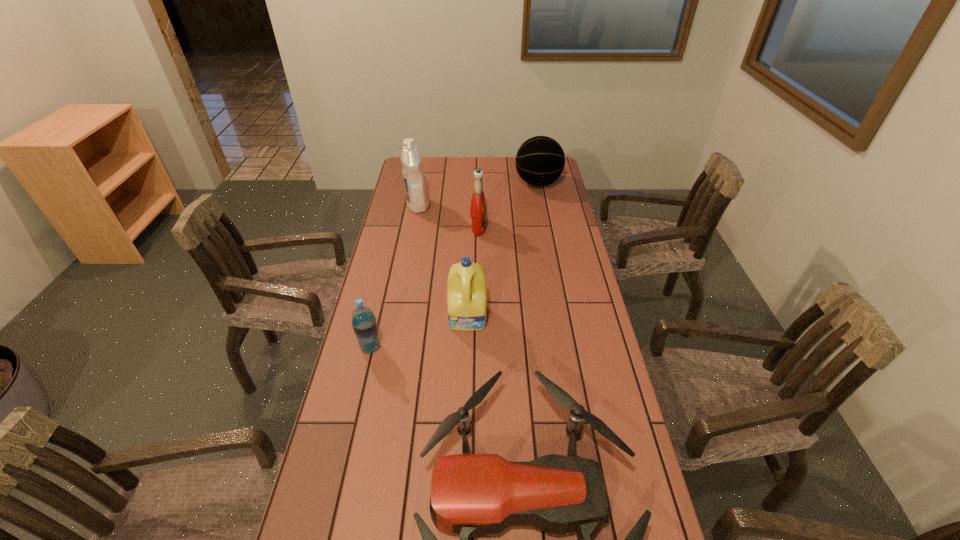
Locate which object ranks in proximity to the drone. Please provide its 2D coordinates. Your answer should be formatted as a tuple, i.e. [(x, y)], where the tuple contains the x and y coordinates of a point satisfying the conditions above.

[(364, 323)]

Identify which object is the third closest to the fifth farthest object. Please provide its 2D coordinates. Your answer should be formatted as a tuple, i.e. [(x, y)], where the tuple contains the x and y coordinates of a point satisfying the conditions above.

[(478, 212)]

Identify the location of the second closest detergent to the fifth nearest object. (467, 304).

Where is `detergent that is the second closest to the third nearest object`? The image size is (960, 540). detergent that is the second closest to the third nearest object is located at coordinates (413, 172).

What are the coordinates of `vacant space that satisfies the following two spatial constraints: 1. on the back side of the second farthest object; 2. on the right side of the fifth farthest object` in the screenshot? It's located at (404, 205).

Where is `free space in the image that satisfies the following two spatial constraints: 1. on the front side of the basketball; 2. on the front surface of the second nearest detergent`? The width and height of the screenshot is (960, 540). free space in the image that satisfies the following two spatial constraints: 1. on the front side of the basketball; 2. on the front surface of the second nearest detergent is located at coordinates (546, 227).

The image size is (960, 540). I want to click on free space that satisfies the following two spatial constraints: 1. on the front surface of the second nearest detergent; 2. on the label of the nearest detergent, so click(x=478, y=318).